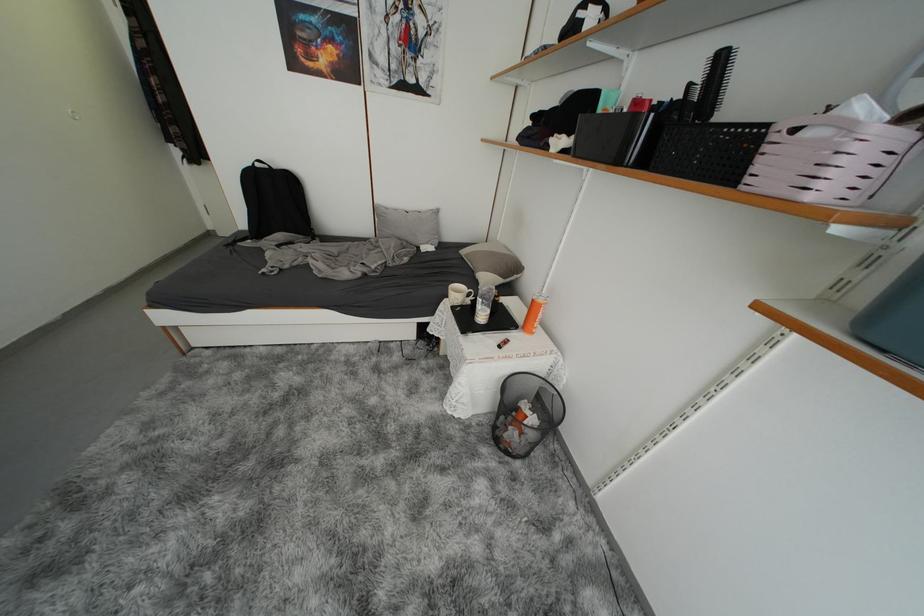
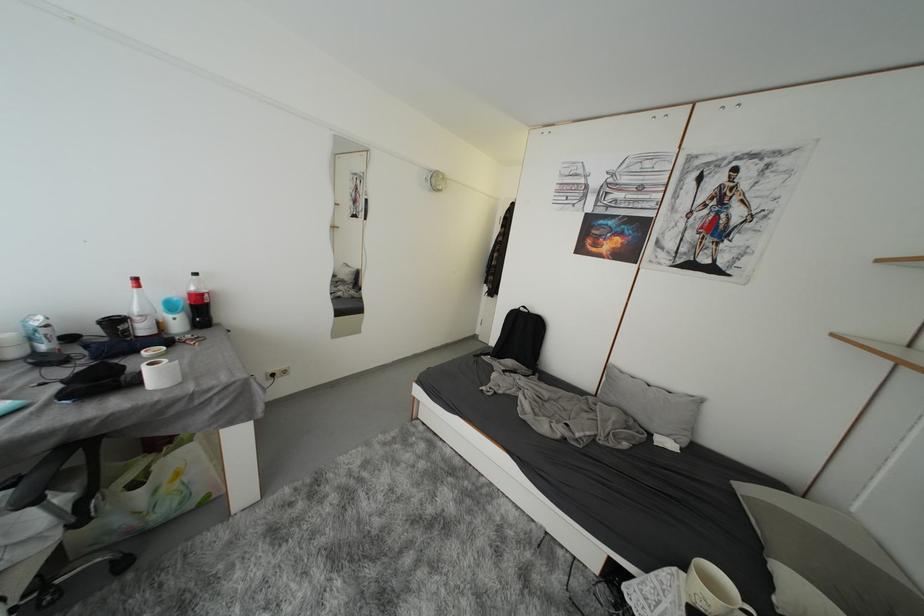
Question: The first image is from the beginning of the video and the second image is from the end. How did the camera likely rotate when shooting the video?

Choices:
 (A) Left
 (B) Right
 (C) Up
 (D) Down

Answer: (A)